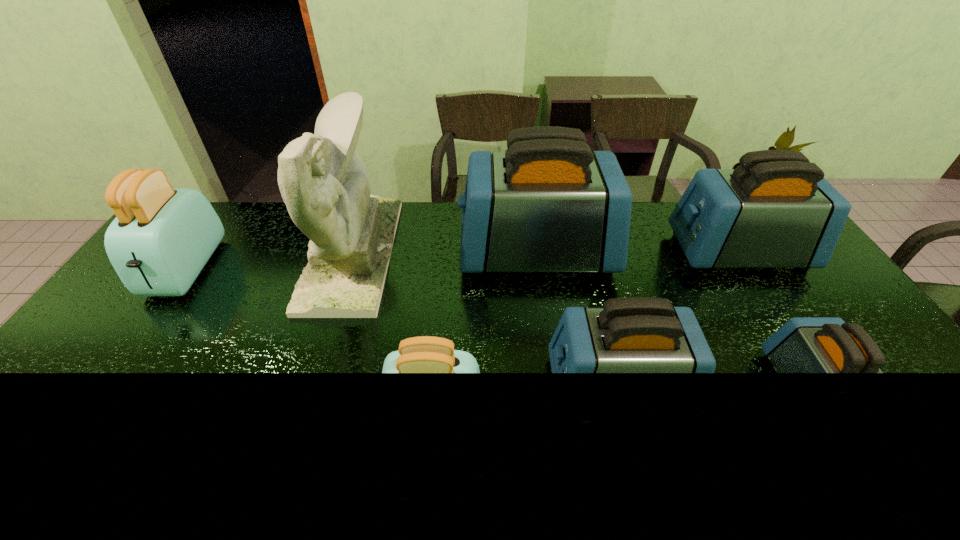
Locate an element on the screen. The width and height of the screenshot is (960, 540). sculpture is located at coordinates (324, 182).

Locate an element on the screen. the second object from left to right is located at coordinates (324, 182).

The image size is (960, 540). Find the location of `the tallest toaster`. the tallest toaster is located at coordinates (547, 204).

This screenshot has height=540, width=960. I want to click on the biggest blue toaster, so click(x=547, y=204).

You are a GUI agent. You are given a task and a screenshot of the screen. Output one action in this format:
    pyautogui.click(x=<x>, y=<y>)
    Task: Click on the second biggest blue toaster
    The image size is (960, 540).
    Given the screenshot: What is the action you would take?
    [x=775, y=210]

You are a GUI agent. You are given a task and a screenshot of the screen. Output one action in this format:
    pyautogui.click(x=<x>, y=<y>)
    Task: Click on the left light toaster
    The image size is (960, 540).
    Given the screenshot: What is the action you would take?
    pyautogui.click(x=162, y=237)

Locate an element on the screen. the leftmost object is located at coordinates (162, 237).

Where is `the second smallest blue toaster`? This screenshot has height=540, width=960. the second smallest blue toaster is located at coordinates (632, 334).

Locate an element on the screen. The height and width of the screenshot is (540, 960). the nearer light toaster is located at coordinates (425, 354).

I want to click on the right light toaster, so click(x=425, y=354).